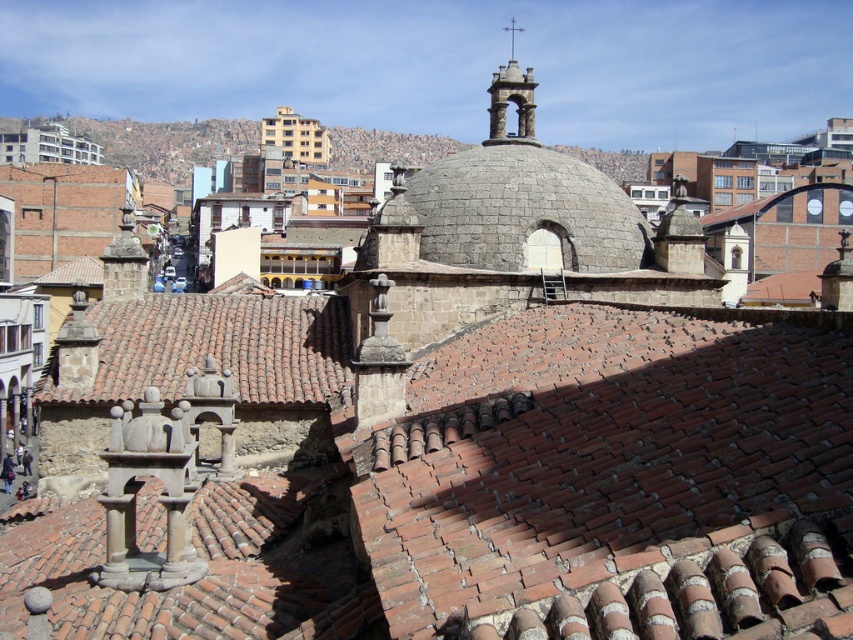
You are an architect examining the historic urban landscape. You notice the brown clay tiles at center and the gray stone dome at center. Which of these two features is positioned lower in the scene?

The brown clay tiles at center are positioned below the gray stone dome at center, so they are lower in the scene.

You are an architect examining the historic urban landscape. You notice the brown clay tiles at center and the brown tile roof at center. Which of these two objects is closer to your viewpoint?

The brown clay tiles at center are closer to your viewpoint because they are positioned in front of the brown tile roof at center.